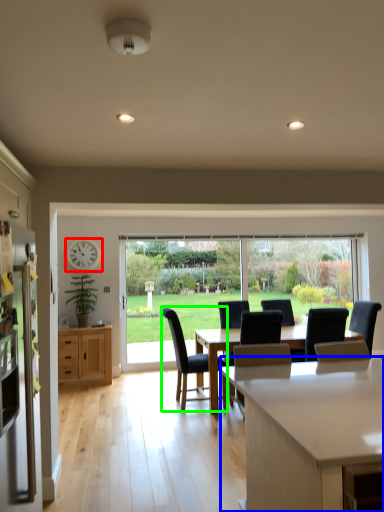
Question: Based on their relative distances, which object is farther from clock (highlighted by a red box)? Choose from countertop (highlighted by a blue box) and chair (highlighted by a green box).

Choices:
 (A) countertop
 (B) chair

Answer: (A)